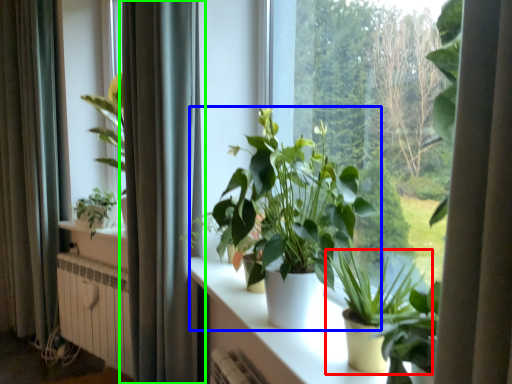
Question: Which object is positioned farthest from houseplant (highlighted by a red box)? Select from houseplant (highlighted by a blue box) and curtain (highlighted by a green box).

Choices:
 (A) houseplant
 (B) curtain

Answer: (B)